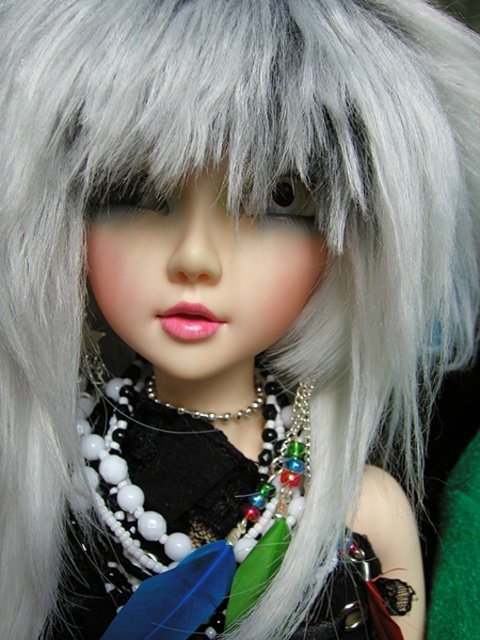
You are a jewelry designer examining the doll and notice the multicolored beaded necklace at center and the pearl beaded necklace at center. Which necklace is positioned higher on the doll?

The pearl beaded necklace at center is positioned higher on the doll since the multicolored beaded necklace at center is located below it.

You are a photographer adjusting the focus on your camera. You want to capture the multicolored beaded necklace at center clearly. The camera can only focus on objects at a specific point. Given that the point you need to focus on is point (180, 516), can you confirm if this point corresponds to the multicolored beaded necklace at center?

Yes, the point (180, 516) corresponds to the multicolored beaded necklace at center, so focusing there will capture it clearly.